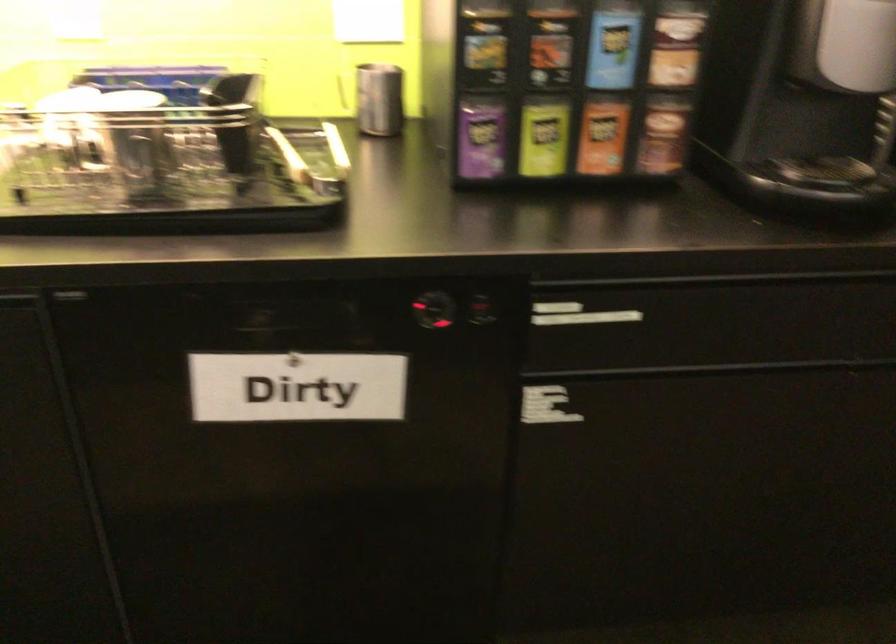
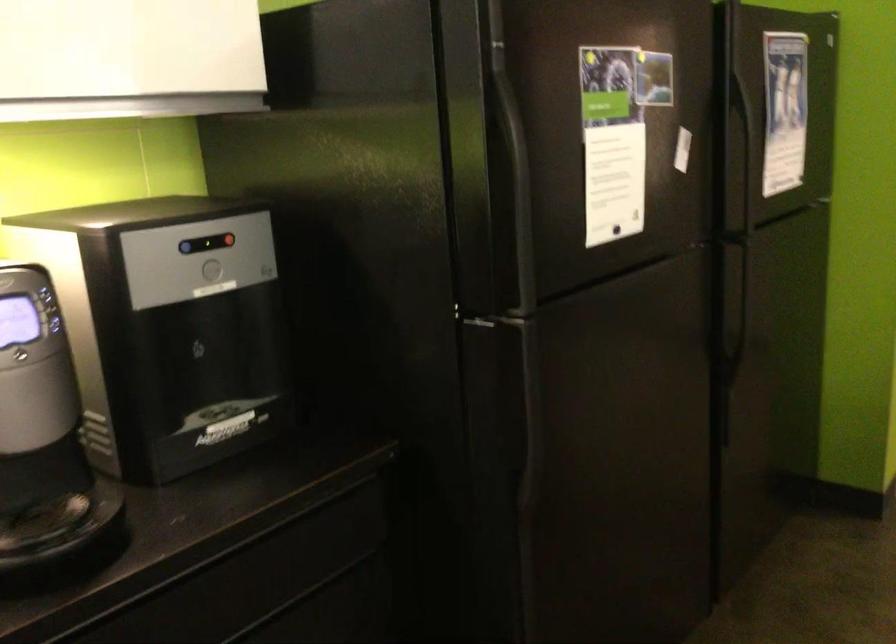
Question: How did the camera likely rotate?

Choices:
 (A) Left
 (B) Right
 (C) Up
 (D) Down

Answer: (B)